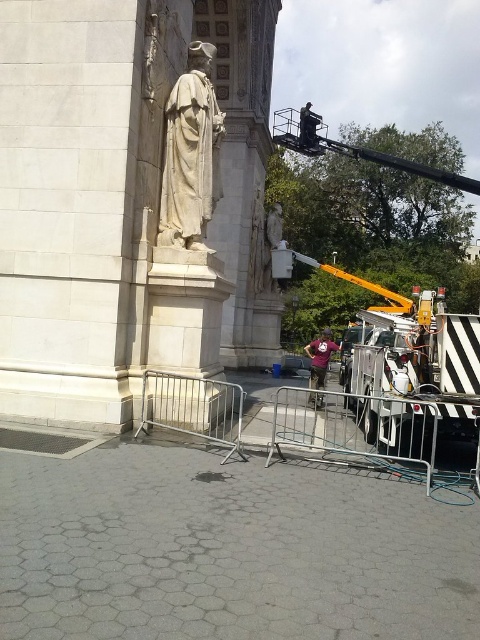
Question: Does white marble statue at upper left have a greater width compared to purple fabric construction worker at center?

Choices:
 (A) no
 (B) yes

Answer: (A)

Question: Which point is farther from the camera taking this photo?

Choices:
 (A) (163, 173)
 (B) (312, 362)

Answer: (B)

Question: Which point is closer to the camera?

Choices:
 (A) white marble statue at upper left
 (B) purple fabric construction worker at center

Answer: (A)

Question: Does white marble statue at upper left have a smaller size compared to purple fabric construction worker at center?

Choices:
 (A) yes
 (B) no

Answer: (A)

Question: Can you confirm if white marble statue at upper left is bigger than purple fabric construction worker at center?

Choices:
 (A) no
 (B) yes

Answer: (A)